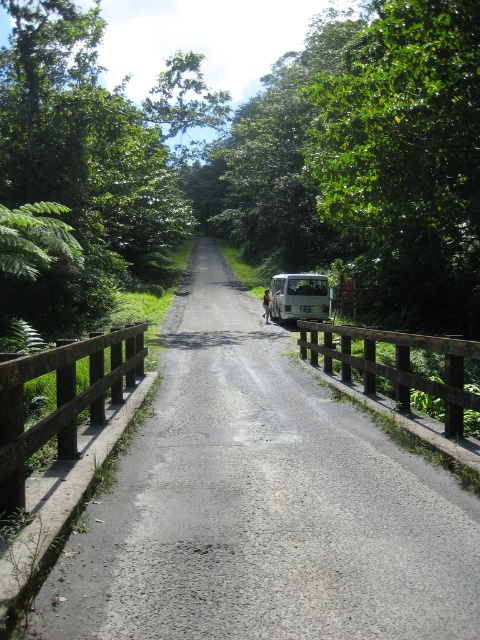
Question: In this image, where is green leafy tree at center located relative to green leafy tree at upper center?

Choices:
 (A) left
 (B) right

Answer: (A)

Question: Is smooth concrete road at center wider than green leafy tree at upper center?

Choices:
 (A) yes
 (B) no

Answer: (B)

Question: Among these objects, which one is nearest to the camera?

Choices:
 (A) white matte van at center
 (B) green leafy tree at center

Answer: (B)

Question: Is green leafy tree at upper right thinner than green leafy tree at center?

Choices:
 (A) yes
 (B) no

Answer: (A)

Question: Considering the real-world distances, which object is farthest from the green leafy tree at center?

Choices:
 (A) green leafy tree at upper right
 (B) smooth concrete road at center
 (C) green leafy tree at upper center
 (D) white matte van at center

Answer: (B)

Question: Which of the following is the closest to the observer?

Choices:
 (A) pyautogui.click(x=321, y=292)
 (B) pyautogui.click(x=312, y=541)

Answer: (B)